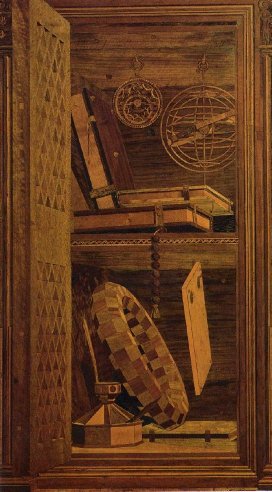
This screenshot has width=272, height=492. In order to click on woodwork in this screenshot , I will do `click(200, 439)`.